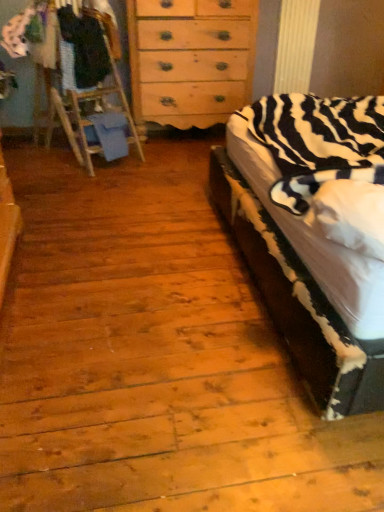
Question: Is dark blue fabric at left, the 2th clothing when ordered from left to right, taller or shorter than white cotton shirt at upper left, arranged as the first clothing when viewed from the left?

Choices:
 (A) short
 (B) tall

Answer: (B)

Question: Looking at their shapes, would you say dark blue fabric at left, the 2th clothing when ordered from left to right, is wider or thinner than white cotton shirt at upper left, placed as the 2th clothing when sorted from right to left?

Choices:
 (A) thin
 (B) wide

Answer: (B)

Question: Which of these objects is positioned closest to the dark blue fabric at left, the 2th clothing when ordered from left to right?

Choices:
 (A) white cotton shirt at upper left, placed as the 2th clothing when sorted from right to left
 (B) light brown wooden dresser at center
 (C) zebra-patterned fabric at right

Answer: (A)

Question: Estimate the real-world distances between objects in this image. Which object is closer to the zebra-patterned fabric at right?

Choices:
 (A) light brown wooden dresser at center
 (B) white cotton shirt at upper left, arranged as the first clothing when viewed from the left
 (C) dark blue fabric at left, the 1th clothing from the right

Answer: (A)